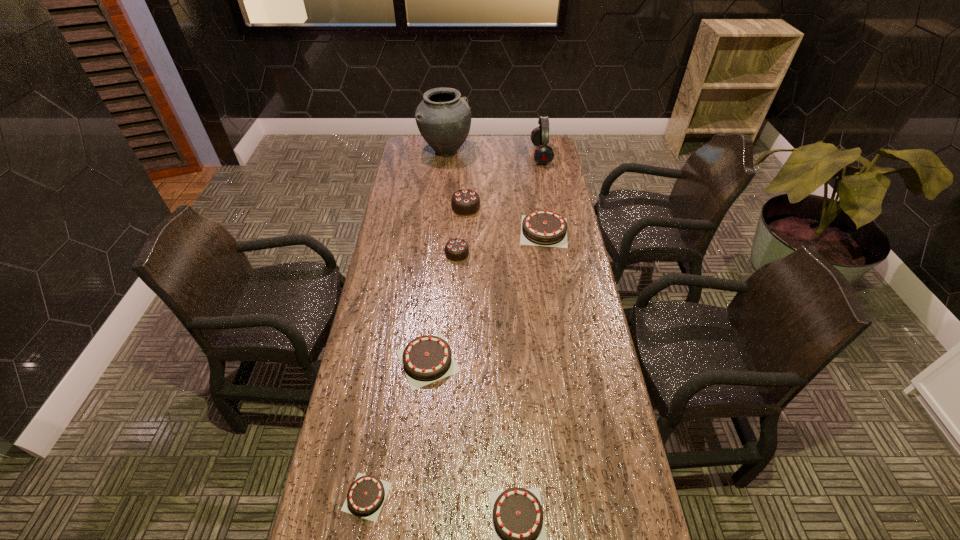
Where is `black urn`? The height and width of the screenshot is (540, 960). black urn is located at coordinates (443, 118).

Locate an element on the screen. This screenshot has height=540, width=960. urn is located at coordinates (443, 118).

Where is `the seventh shortest object`? The width and height of the screenshot is (960, 540). the seventh shortest object is located at coordinates (543, 154).

Where is `earphone`? The width and height of the screenshot is (960, 540). earphone is located at coordinates (543, 154).

Where is `the sixth shortest object`? The width and height of the screenshot is (960, 540). the sixth shortest object is located at coordinates (465, 202).

Locate an element on the screen. Image resolution: width=960 pixels, height=540 pixels. the farther chocolate chocolate cake is located at coordinates (465, 202).

Where is `the nearer chocolate chocolate cake`? This screenshot has height=540, width=960. the nearer chocolate chocolate cake is located at coordinates (456, 249).

At what (x,y) coordinates should I click in order to perform the action: click on the biggest brown chocolate cake. Please return your answer as a coordinate pair (x, y). Looking at the image, I should click on (542, 227).

The image size is (960, 540). What are the coordinates of `the rightmost chocolate cake` in the screenshot? It's located at (542, 227).

Identify the location of the second biggest brown chocolate cake. (426, 359).